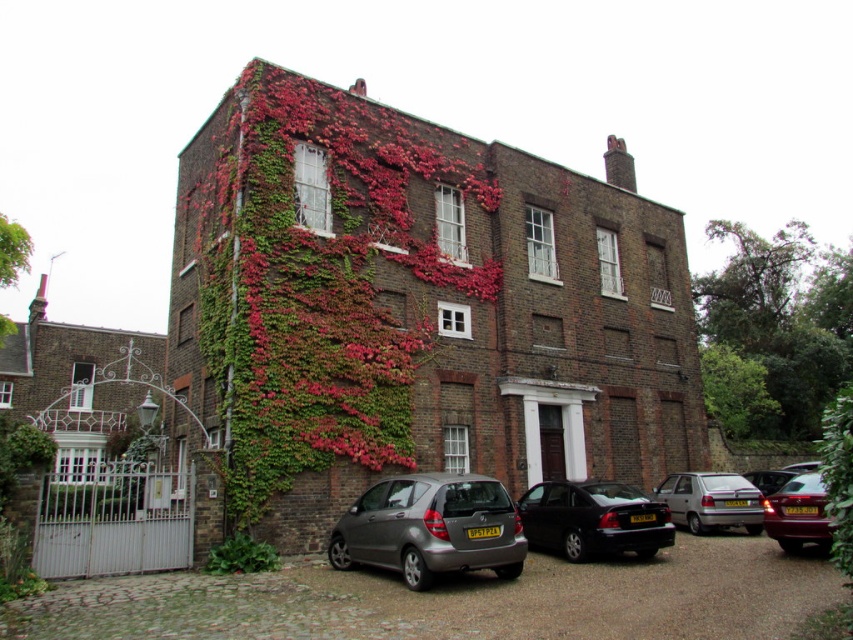
Can you confirm if shiny maroon sedan at right is wider than metallic silver car at center?

No, shiny maroon sedan at right is not wider than metallic silver car at center.

This screenshot has height=640, width=853. What do you see at coordinates (798, 513) in the screenshot?
I see `shiny maroon sedan at right` at bounding box center [798, 513].

Between point (811, 525) and point (757, 474), which one is positioned behind?

Positioned behind is point (757, 474).

This screenshot has width=853, height=640. I want to click on shiny maroon sedan at right, so click(x=798, y=513).

Between point (616, 490) and point (733, 512), which one is positioned behind?

The point (733, 512) is more distant.

Can you confirm if shiny black sedan at center is thinner than silver metallic car at lower right?

No.

Between point (639, 508) and point (666, 492), which one is positioned behind?

The point (666, 492) is more distant.

You are a GUI agent. You are given a task and a screenshot of the screen. Output one action in this format:
    pyautogui.click(x=<x>, y=<y>)
    Task: Click on the shiny black sedan at center
    The image size is (853, 640).
    Given the screenshot: What is the action you would take?
    pyautogui.click(x=593, y=518)

Can you confirm if satin grey car at lower center is taller than metallic silver car at center?

Yes, satin grey car at lower center is taller than metallic silver car at center.

Does satin grey car at lower center have a lesser height compared to metallic silver car at center?

No, satin grey car at lower center is not shorter than metallic silver car at center.

Who is more forward, (x=498, y=488) or (x=775, y=468)?

Point (x=498, y=488) is more forward.

Identify the location of satin grey car at lower center. Image resolution: width=853 pixels, height=640 pixels. (430, 528).